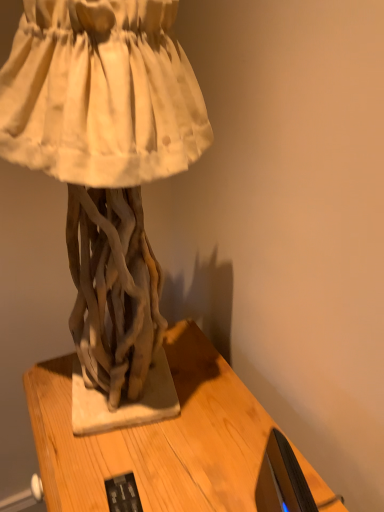
Question: Is black glossy monitor at lower right oriented towards matte driftwood sculpture at center?

Choices:
 (A) no
 (B) yes

Answer: (A)

Question: Does black glossy monitor at lower right appear on the right side of matte driftwood sculpture at center?

Choices:
 (A) no
 (B) yes

Answer: (B)

Question: From a real-world perspective, is black glossy monitor at lower right on matte driftwood sculpture at center?

Choices:
 (A) no
 (B) yes

Answer: (A)

Question: From the image's perspective, is black glossy monitor at lower right on matte driftwood sculpture at center?

Choices:
 (A) no
 (B) yes

Answer: (A)

Question: Is black glossy monitor at lower right bigger than matte driftwood sculpture at center?

Choices:
 (A) yes
 (B) no

Answer: (B)

Question: Can you confirm if black glossy monitor at lower right is shorter than matte driftwood sculpture at center?

Choices:
 (A) yes
 (B) no

Answer: (A)

Question: From the image's perspective, is matte driftwood sculpture at center above black glossy monitor at lower right?

Choices:
 (A) yes
 (B) no

Answer: (A)

Question: Can you confirm if matte driftwood sculpture at center is shorter than black glossy monitor at lower right?

Choices:
 (A) yes
 (B) no

Answer: (B)

Question: From a real-world perspective, is matte driftwood sculpture at center physically above black glossy monitor at lower right?

Choices:
 (A) yes
 (B) no

Answer: (A)

Question: Is matte driftwood sculpture at center to the left of black glossy monitor at lower right from the viewer's perspective?

Choices:
 (A) no
 (B) yes

Answer: (B)

Question: Is matte driftwood sculpture at center not inside black glossy monitor at lower right?

Choices:
 (A) yes
 (B) no

Answer: (A)

Question: Is matte driftwood sculpture at center turned away from black glossy monitor at lower right?

Choices:
 (A) yes
 (B) no

Answer: (B)

Question: Is matte driftwood sculpture at center oriented away from wooden table at center?

Choices:
 (A) yes
 (B) no

Answer: (B)